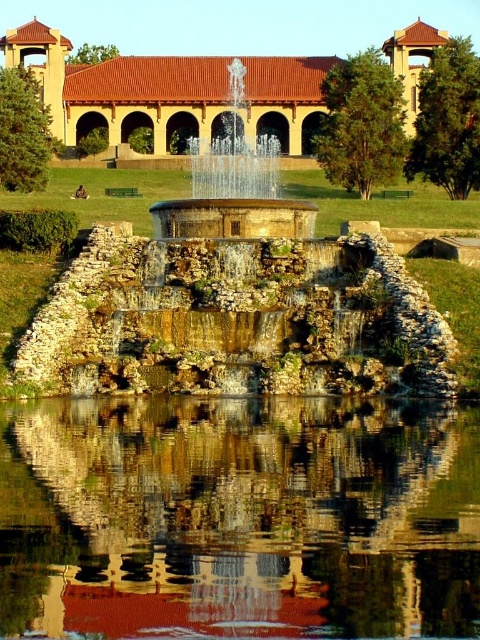
Question: Estimate the real-world distances between objects in this image. Which object is farther from the smooth reflective water at center?

Choices:
 (A) shiny metallic fountain at center
 (B) beige stone building at center

Answer: (B)

Question: Does beige stone building at center have a smaller size compared to shiny metallic fountain at center?

Choices:
 (A) no
 (B) yes

Answer: (A)

Question: Which point appears closest to the camera in this image?

Choices:
 (A) (148, 115)
 (B) (476, 467)
 (C) (288, 228)

Answer: (B)

Question: Considering the relative positions of smooth reflective water at center and beige stone building at center in the image provided, where is smooth reflective water at center located with respect to beige stone building at center?

Choices:
 (A) right
 (B) left

Answer: (B)

Question: Can you confirm if smooth reflective water at center is thinner than beige stone building at center?

Choices:
 (A) yes
 (B) no

Answer: (A)

Question: Which object is farther from the camera taking this photo?

Choices:
 (A) shiny metallic fountain at center
 (B) beige stone building at center

Answer: (B)